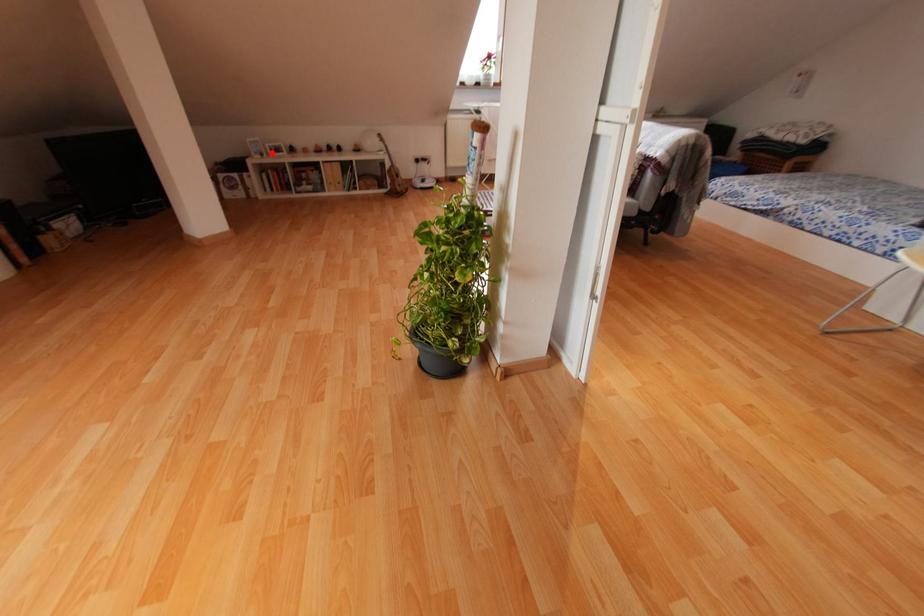
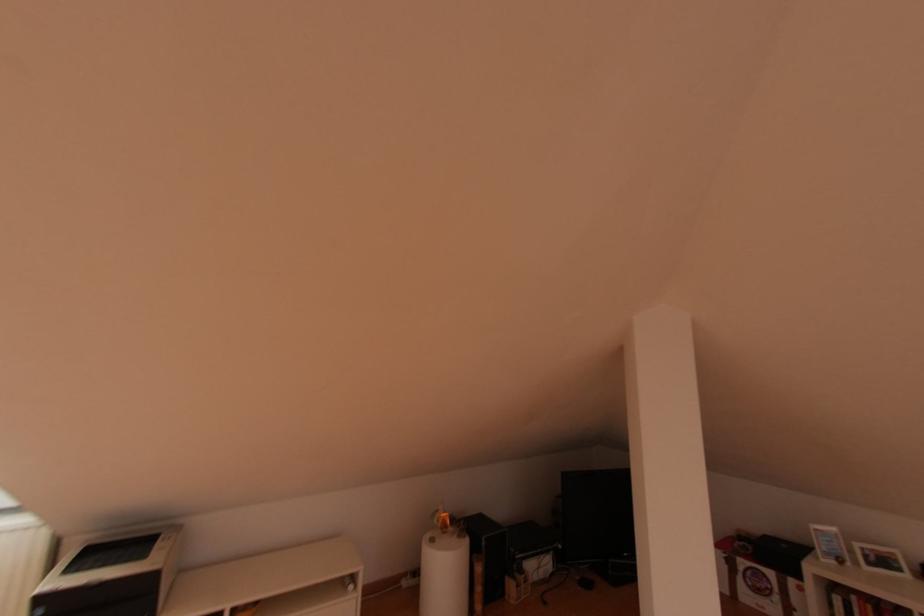
The point at the highlighted location is marked in the first image. Where is the corresponding point in the second image?

(869, 564)